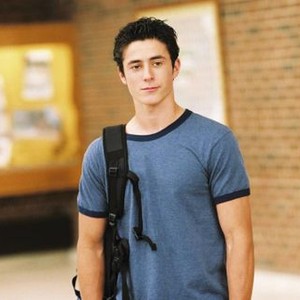
At what (x,y) coordinates should I click in order to perform the action: click on brick wall. Please return your answer as a coordinate pair (x, y). This screenshot has height=300, width=300. Looking at the image, I should click on 249,87, 89,65.